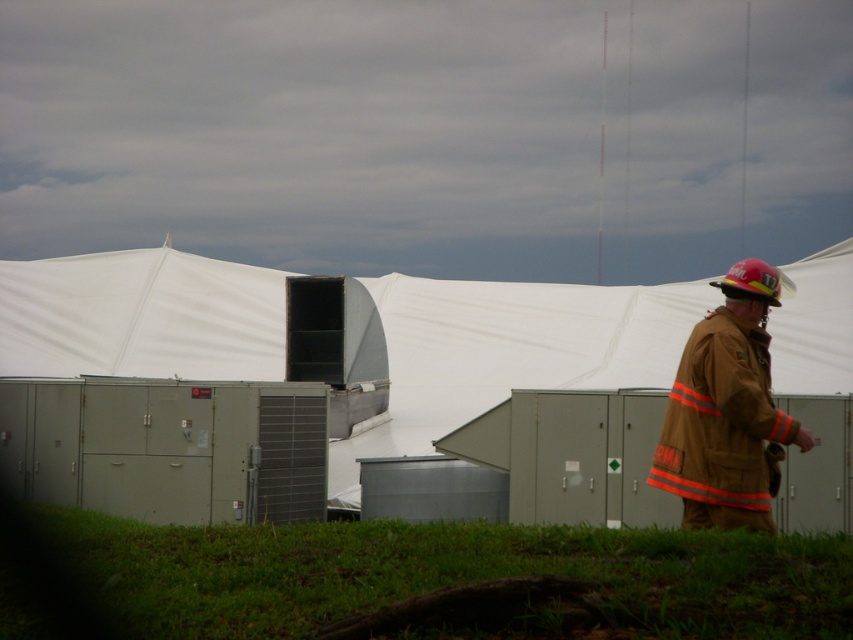
Between green grass at lower center and brown fireman uniform at right, which one appears on the left side from the viewer's perspective?

green grass at lower center is more to the left.

Can you confirm if green grass at lower center is wider than brown fireman uniform at right?

Yes.

Image resolution: width=853 pixels, height=640 pixels. What do you see at coordinates (447, 573) in the screenshot?
I see `green grass at lower center` at bounding box center [447, 573].

Where is `green grass at lower center`? green grass at lower center is located at coordinates (447, 573).

Between white fabric tent at center and green grass at lower center, which one is positioned higher?

white fabric tent at center

Between point (19, 321) and point (389, 557), which one is positioned in front?

Point (389, 557) is in front.

Is point (271, 300) more distant than point (482, 531)?

Yes, point (271, 300) is behind point (482, 531).

Identify the location of white fabric tent at center. This screenshot has width=853, height=640. (509, 349).

How far apart are white fabric tent at center and brown fireman uniform at right?

A distance of 19.54 meters exists between white fabric tent at center and brown fireman uniform at right.

Can you confirm if white fabric tent at center is positioned above brown fireman uniform at right?

Actually, white fabric tent at center is below brown fireman uniform at right.

Between point (260, 296) and point (675, 432), which one is positioned behind?

The point (260, 296) is behind.

The width and height of the screenshot is (853, 640). What are the coordinates of `white fabric tent at center` in the screenshot? It's located at (509, 349).